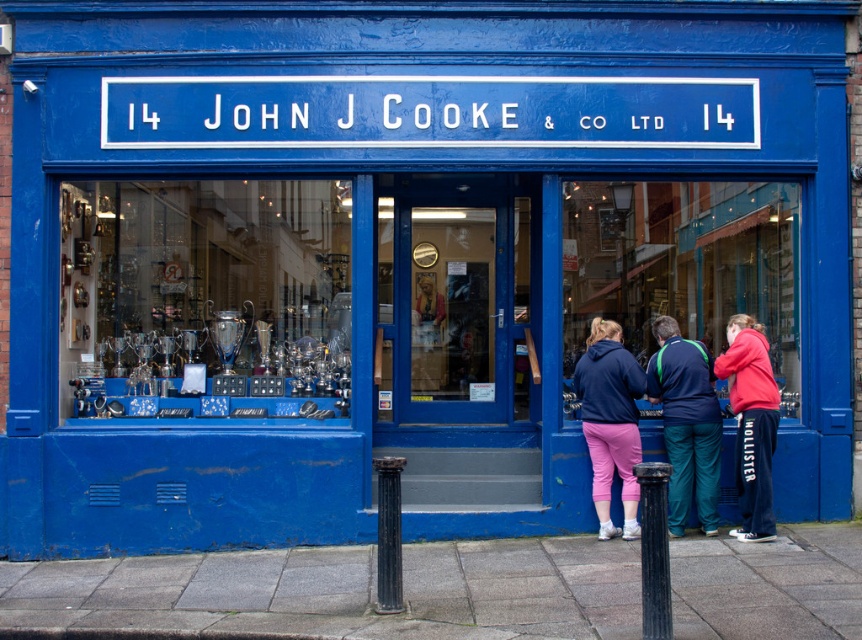
Between point (775, 388) and point (645, 577), which one is positioned behind?

The point (775, 388) is behind.

Between pink fleece at lower right and black textured pole at lower center, which one has less height?

black textured pole at lower center

Identify the location of pink fleece at lower right. (751, 422).

Does shiny silver trophy at center have a greater width compared to pink fleece at lower right?

Indeed, shiny silver trophy at center has a greater width compared to pink fleece at lower right.

Can you confirm if shiny silver trophy at center is shorter than pink fleece at lower right?

No, shiny silver trophy at center is not shorter than pink fleece at lower right.

Where is `shiny silver trophy at center`? The width and height of the screenshot is (862, 640). shiny silver trophy at center is located at coordinates (205, 298).

Between green fabric jacket at center and black textured pole at lower center, which one is positioned higher?

green fabric jacket at center is higher up.

Is point (704, 426) positioned after point (666, 483)?

Yes.

At what (x,y) coordinates should I click in order to perform the action: click on green fabric jacket at center. Please return your answer as a coordinate pair (x, y). The width and height of the screenshot is (862, 640). Looking at the image, I should click on (686, 422).